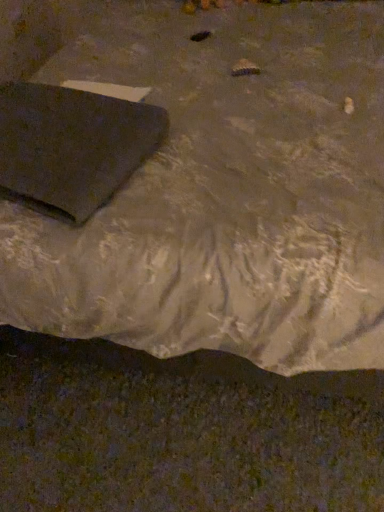
Describe the element at coordinates (72, 146) in the screenshot. This screenshot has width=384, height=512. I see `matte black pad at lower left` at that location.

Find the location of a particular element. The image size is (384, 512). matte black pad at lower left is located at coordinates (72, 146).

What do you see at coordinates (224, 191) in the screenshot? I see `matte black laptop at upper left` at bounding box center [224, 191].

Where is `matte black laptop at upper left`? This screenshot has width=384, height=512. matte black laptop at upper left is located at coordinates [x=224, y=191].

The height and width of the screenshot is (512, 384). Identify the location of matte black pad at lower left. (72, 146).

Is matte black pad at lower left to the right of matte black laptop at upper left from the viewer's perspective?

In fact, matte black pad at lower left is to the left of matte black laptop at upper left.

Considering the positions of objects matte black pad at lower left and matte black laptop at upper left in the image provided, who is in front, matte black pad at lower left or matte black laptop at upper left?

matte black laptop at upper left.

Considering the points (7, 114) and (59, 59), which point is in front, point (7, 114) or point (59, 59)?

The point (7, 114) is closer to the camera.

From the image's perspective, relative to matte black laptop at upper left, is matte black pad at lower left above or below?

From the image's perspective, matte black pad at lower left appears below matte black laptop at upper left.

From a real-world perspective, between matte black pad at lower left and matte black laptop at upper left, who is vertically higher?

matte black pad at lower left.

Is matte black pad at lower left thinner than matte black laptop at upper left?

Correct, the width of matte black pad at lower left is less than that of matte black laptop at upper left.

In terms of height, does matte black pad at lower left look taller or shorter compared to matte black laptop at upper left?

Clearly, matte black pad at lower left is shorter compared to matte black laptop at upper left.

Looking at the image, does matte black pad at lower left seem bigger or smaller compared to matte black laptop at upper left?

In the image, matte black pad at lower left appears to be smaller than matte black laptop at upper left.

Is matte black pad at lower left spatially inside matte black laptop at upper left, or outside of it?

matte black pad at lower left can be found inside matte black laptop at upper left.

Is matte black pad at lower left far away from matte black laptop at upper left?

No, matte black pad at lower left is not far away from matte black laptop at upper left.

Is matte black pad at lower left oriented away from matte black laptop at upper left?

Yes, matte black laptop at upper left is at the back of matte black pad at lower left.

How many degrees apart are the facing directions of matte black pad at lower left and matte black laptop at upper left?

They differ by 17.1 degrees in their facing directions.

Where is `pad above the matte black laptop at upper left (from a real-world perspective)`? The width and height of the screenshot is (384, 512). pad above the matte black laptop at upper left (from a real-world perspective) is located at coordinates (72, 146).

Considering the positions of objects matte black laptop at upper left and matte black pad at lower left in the image provided, who is more to the left, matte black laptop at upper left or matte black pad at lower left?

matte black pad at lower left is more to the left.

Is the depth of matte black laptop at upper left less than that of matte black pad at lower left?

That is True.

Is point (309, 176) farther from camera compared to point (53, 115)?

No, it is not.

From the image's perspective, which is below, matte black laptop at upper left or matte black pad at lower left?

matte black pad at lower left appears lower in the image.

From a real-world perspective, between matte black laptop at upper left and matte black pad at lower left, who is vertically lower?

From a 3D spatial view, matte black laptop at upper left is below.

Considering the relative sizes of matte black laptop at upper left and matte black pad at lower left in the image provided, is matte black laptop at upper left thinner than matte black pad at lower left?

No.

Is matte black laptop at upper left taller or shorter than matte black pad at lower left?

In the image, matte black laptop at upper left appears to be taller than matte black pad at lower left.

Consider the image. Is matte black laptop at upper left bigger than matte black pad at lower left?

Yes.

Do you think matte black laptop at upper left is within matte black pad at lower left, or outside of it?

matte black laptop at upper left is located beyond the bounds of matte black pad at lower left.

Is matte black laptop at upper left far from matte black pad at lower left?

Result: No, there isn't a large distance between matte black laptop at upper left and matte black pad at lower left.

Is matte black laptop at upper left facing towards matte black pad at lower left?

Yes, matte black laptop at upper left is facing matte black pad at lower left.

How different are the orientations of matte black laptop at upper left and matte black pad at lower left in degrees?

There is a 17.1-degree angle between the facing directions of matte black laptop at upper left and matte black pad at lower left.

At what (x,y) coordinates should I click in order to perform the action: click on pad positioned vertically above the matte black laptop at upper left (from a real-world perspective). Please return your answer as a coordinate pair (x, y). Image resolution: width=384 pixels, height=512 pixels. Looking at the image, I should click on (72, 146).

This screenshot has width=384, height=512. I want to click on furniture located above the matte black pad at lower left (from the image's perspective), so (x=224, y=191).

What are the coordinates of `pad that appears behind the matte black laptop at upper left` in the screenshot? It's located at (72, 146).